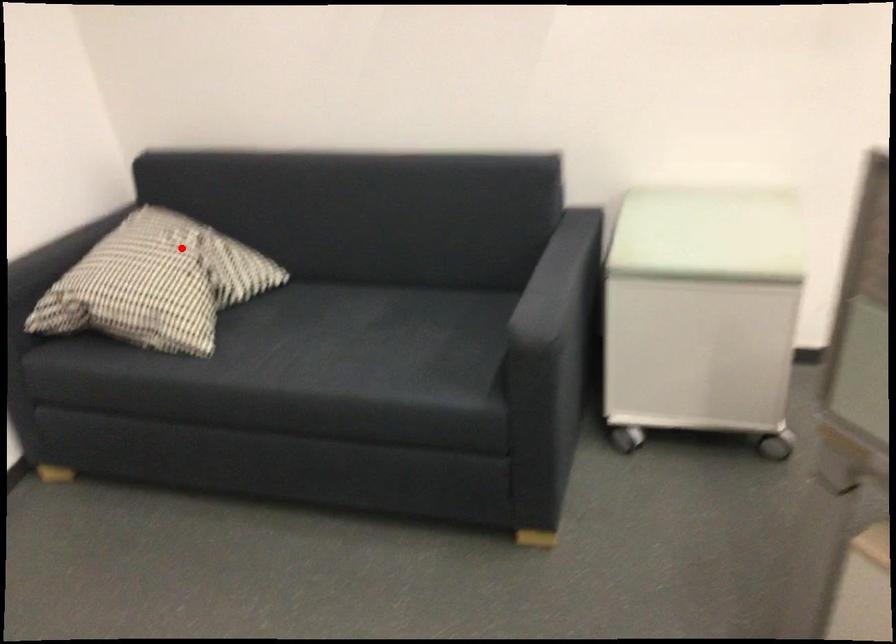
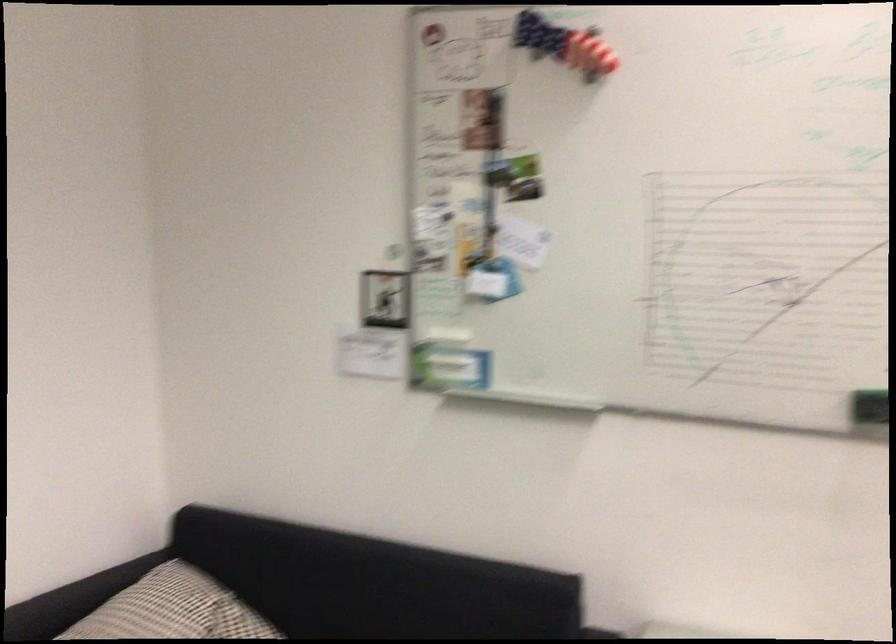
Locate, in the second image, the point that corresponds to the highlighted location in the first image.

(193, 612)